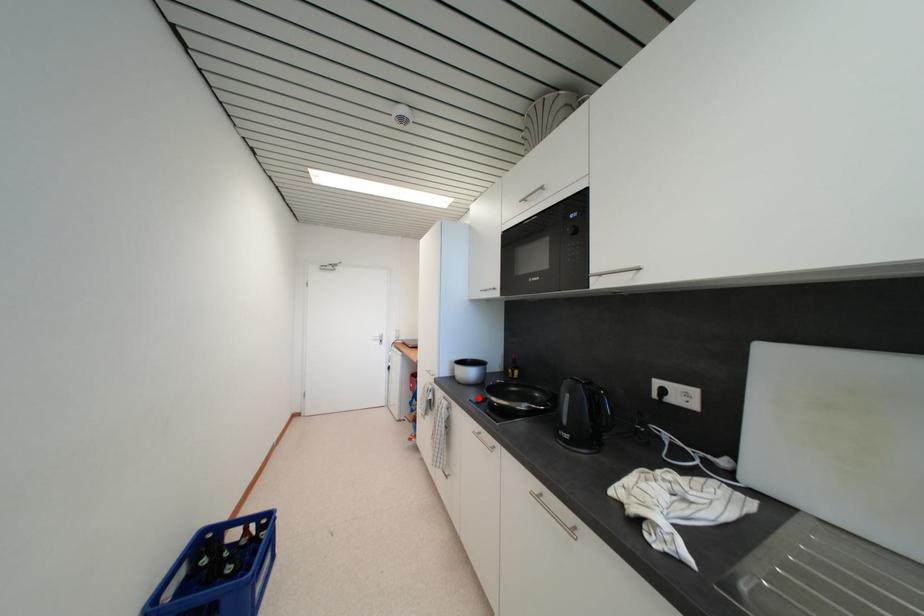
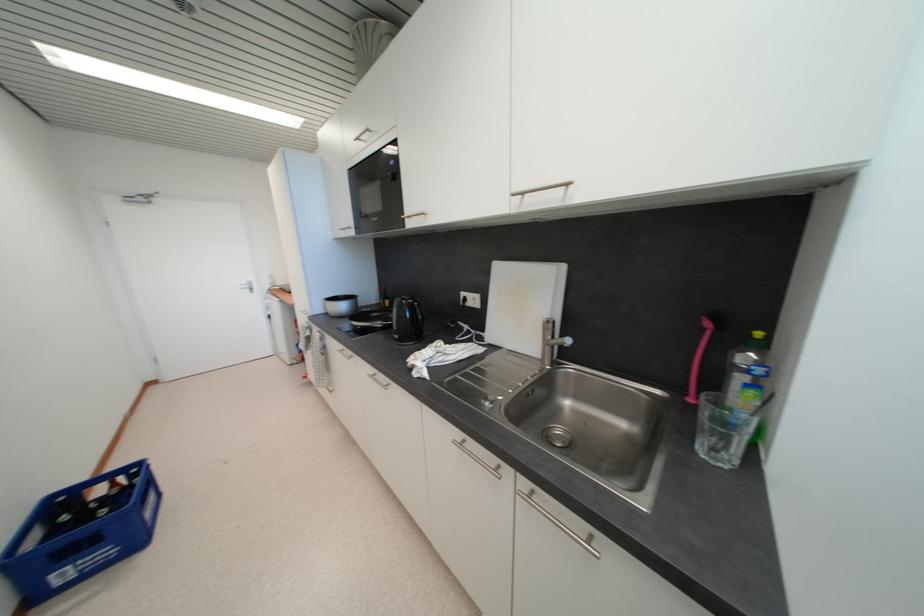
In the second image, find the point that corresponds to the highlighted location in the first image.

(351, 328)